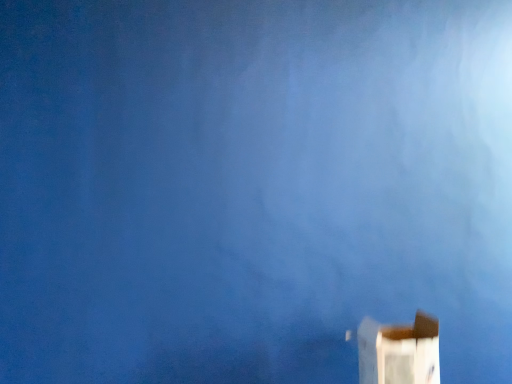
The image size is (512, 384). I want to click on white cardboard box at lower right, so click(399, 352).

In order to face white cardboard box at lower right, should I rotate leftwards or rightwards?

You should look right and rotate roughly 16.758 degrees.

Measure the distance between point (412, 354) and camera.

Point (412, 354) is 1.36 meters away from camera.

Image resolution: width=512 pixels, height=384 pixels. What do you see at coordinates (399, 352) in the screenshot? I see `white cardboard box at lower right` at bounding box center [399, 352].

This screenshot has width=512, height=384. What are the coordinates of `white cardboard box at lower right` in the screenshot? It's located at (399, 352).